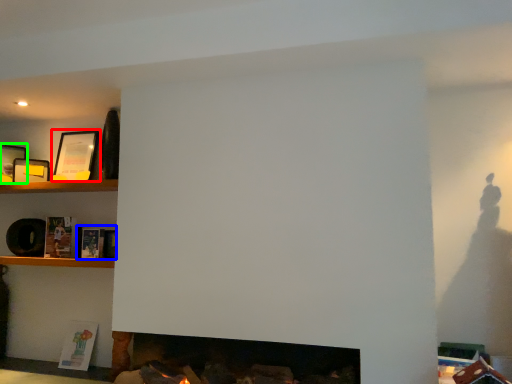
Question: Which object is the closest to the picture frame (highlighted by a red box)? Choose among these: book (highlighted by a blue box) or picture frame (highlighted by a green box).

Choices:
 (A) book
 (B) picture frame

Answer: (B)